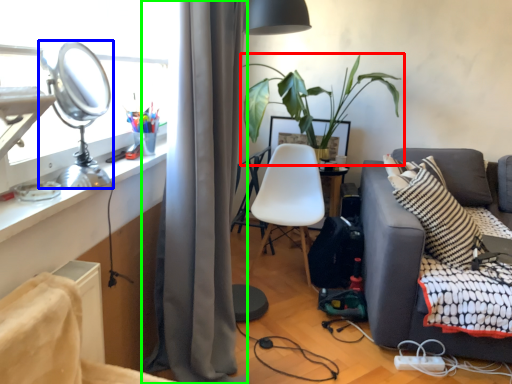
Question: Which object is positioned farthest from houseplant (highlighted by a red box)? Select from table lamp (highlighted by a blue box) and curtain (highlighted by a green box).

Choices:
 (A) table lamp
 (B) curtain

Answer: (A)